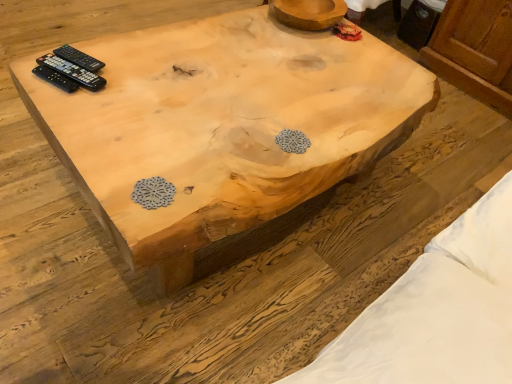
The width and height of the screenshot is (512, 384). I want to click on unoccupied space behind black plastic remote at upper left, arranged as the first remote control when viewed from the front, so click(x=115, y=47).